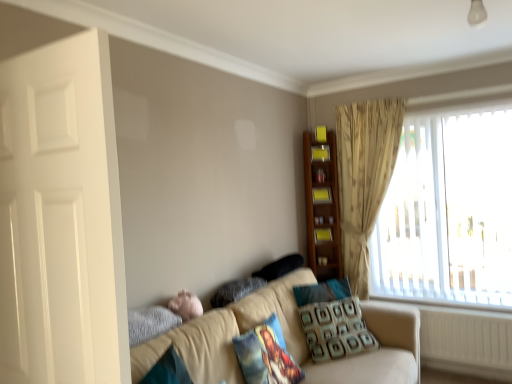
In order to face white glossy door at left, should I rotate leftwards or rightwards?

Turn left approximately 27.447 degrees to face it.

What do you see at coordinates (323, 235) in the screenshot? Image resolution: width=512 pixels, height=384 pixels. I see `wooden bookshelf at upper right, acting as the 3th shelf starting from the top` at bounding box center [323, 235].

The image size is (512, 384). What do you see at coordinates (280, 267) in the screenshot?
I see `black fabric pillow at center, the 4th pillow viewed from the front` at bounding box center [280, 267].

Measure the distance between black fabric pillow at center, placed as the 1th pillow when sorted from back to front, and camera.

A distance of 9.24 feet exists between black fabric pillow at center, placed as the 1th pillow when sorted from back to front, and camera.

Where is `translucent plastic window at right`? This screenshot has width=512, height=384. translucent plastic window at right is located at coordinates (448, 211).

Describe the element at coordinates (364, 177) in the screenshot. I see `beige textured curtain at upper right` at that location.

Describe the element at coordinates (466, 341) in the screenshot. I see `white plastic radiator at lower right` at that location.

Describe the element at coordinates (288, 340) in the screenshot. This screenshot has width=512, height=384. I see `beige fabric couch at lower center` at that location.

Where is `white glossy door at left`? This screenshot has height=384, width=512. white glossy door at left is located at coordinates (61, 218).

Is wooden bookshelf at upper right, acting as the 3th shelf starting from the top, to the left of white glossy door at left from the viewer's perspective?

No, wooden bookshelf at upper right, acting as the 3th shelf starting from the top, is not to the left of white glossy door at left.

Would you consider wooden bookshelf at upper right, acting as the 3th shelf starting from the top, to be distant from white glossy door at left?

Yes, wooden bookshelf at upper right, acting as the 3th shelf starting from the top, and white glossy door at left are quite far apart.

From the image's perspective, relative to white glossy door at left, is wooden bookshelf at upper right, acting as the 3th shelf starting from the top, above or below?

wooden bookshelf at upper right, acting as the 3th shelf starting from the top, is situated lower than white glossy door at left in the image.

Is white glossy door at left at the back of wooden bookshelf at upper right, acting as the 3th shelf starting from the top?

No, wooden bookshelf at upper right, acting as the 3th shelf starting from the top, is not facing away from white glossy door at left.

Are white glossy door at left and black fabric pillow at center, the 4th pillow viewed from the front, making contact?

white glossy door at left and black fabric pillow at center, the 4th pillow viewed from the front, are clearly separated.

Which of these two, white glossy door at left or black fabric pillow at center, placed as the 1th pillow when sorted from back to front, is bigger?

white glossy door at left is bigger.

Considering the sizes of objects white glossy door at left and black fabric pillow at center, placed as the 1th pillow when sorted from back to front, in the image provided, who is thinner, white glossy door at left or black fabric pillow at center, placed as the 1th pillow when sorted from back to front,?

With smaller width is white glossy door at left.

Which of these two, wooden shelf at upper right, which is the first shelf in top-to-bottom order, or pink plush at lower left, is wider?

Wider between the two is pink plush at lower left.

Based on the photo, which of these two, wooden shelf at upper right, which is the first shelf in top-to-bottom order, or pink plush at lower left, stands taller?

With more height is pink plush at lower left.

Is point (316, 157) positioned in front of point (195, 312)?

No, (316, 157) is further to viewer.

Is wooden shelf at upper right, the 3th shelf in the bottom-to-top sequence, behind pink plush at lower left?

Yes, it is.

Is white plastic radiator at lower right not close to black fabric pillow at center, placed as the 1th pillow when sorted from back to front?

Yes, white plastic radiator at lower right is far from black fabric pillow at center, placed as the 1th pillow when sorted from back to front.

Is white plastic radiator at lower right at the left side of black fabric pillow at center, the 4th pillow viewed from the front?

Incorrect, white plastic radiator at lower right is not on the left side of black fabric pillow at center, the 4th pillow viewed from the front.

Is black fabric pillow at center, placed as the 1th pillow when sorted from back to front, at the back of white plastic radiator at lower right?

white plastic radiator at lower right is not turned away from black fabric pillow at center, placed as the 1th pillow when sorted from back to front.

From a real-world perspective, between white plastic radiator at lower right and black fabric pillow at center, placed as the 1th pillow when sorted from back to front, who is vertically higher?

black fabric pillow at center, placed as the 1th pillow when sorted from back to front, from a real-world perspective.

From a real-world perspective, is wooden shelf at upper right, the 3th shelf in the bottom-to-top sequence, physically located above or below black fabric pillow at center, placed as the 1th pillow when sorted from back to front?

From a real-world perspective, wooden shelf at upper right, the 3th shelf in the bottom-to-top sequence, is physically above black fabric pillow at center, placed as the 1th pillow when sorted from back to front.

In the scene shown: Visually, is wooden shelf at upper right, which is the first shelf in top-to-bottom order, positioned to the left or to the right of black fabric pillow at center, placed as the 1th pillow when sorted from back to front?

wooden shelf at upper right, which is the first shelf in top-to-bottom order, is positioned on black fabric pillow at center, placed as the 1th pillow when sorted from back to front,'s right side.

Is point (318, 158) positioned behind point (278, 259)?

That is True.

Does white plastic radiator at lower right have a greater height compared to pink plush at lower left?

Yes, white plastic radiator at lower right is taller than pink plush at lower left.

In the scene shown: Considering the relative sizes of white plastic radiator at lower right and pink plush at lower left in the image provided, is white plastic radiator at lower right wider than pink plush at lower left?

No, white plastic radiator at lower right is not wider than pink plush at lower left.

Does point (431, 361) lie in front of point (183, 308)?

No, it is not.

In the image, is white plastic radiator at lower right on the left side or the right side of pink plush at lower left?

white plastic radiator at lower right is to the right of pink plush at lower left.

Can you tell me how much printed fabric pillow at center, the first pillow viewed from the front, and white plastic radiator at lower right differ in facing direction?

The angular difference between printed fabric pillow at center, the first pillow viewed from the front, and white plastic radiator at lower right is 89.8 degrees.

Is printed fabric pillow at center, the first pillow viewed from the front, turned away from white plastic radiator at lower right?

No, white plastic radiator at lower right is not at the back of printed fabric pillow at center, the first pillow viewed from the front.

Who is bigger, printed fabric pillow at center, which is counted as the 4th pillow, starting from the back, or white plastic radiator at lower right?

Bigger between the two is white plastic radiator at lower right.

Identify the location of radiator on the right of printed fabric pillow at center, the first pillow viewed from the front. The width and height of the screenshot is (512, 384). (466, 341).

Image resolution: width=512 pixels, height=384 pixels. In order to click on shelf below the white glossy door at left (from the image's perspective) in this screenshot , I will do `click(323, 235)`.

The width and height of the screenshot is (512, 384). Identify the location of screen door located above the black fabric pillow at center, placed as the 1th pillow when sorted from back to front (from the image's perspective). (61, 218).

Estimate the real-world distances between objects in this image. Which object is closer to wooden bookshelf at upper right, acting as the 1th shelf starting from the bottom, white plastic radiator at lower right or black fabric pillow at center, the 4th pillow viewed from the front?

black fabric pillow at center, the 4th pillow viewed from the front, lies closer to wooden bookshelf at upper right, acting as the 1th shelf starting from the bottom, than the other object.

Considering their positions, is wooden bookshelf at upper right, acting as the 1th shelf starting from the bottom, positioned closer to velvety gray pillow at lower center, the third pillow from the back, than white plastic radiator at lower right?

wooden bookshelf at upper right, acting as the 1th shelf starting from the bottom, lies closer to velvety gray pillow at lower center, the third pillow from the back, than the other object.

Which object lies nearer to the anchor point beige textured curtain at upper right, wooden bookshelf at upper right, acting as the 3th shelf starting from the top, or printed fabric pillow at center, which is counted as the 4th pillow, starting from the back?

Based on the image, wooden bookshelf at upper right, acting as the 3th shelf starting from the top, appears to be nearer to beige textured curtain at upper right.

Estimate the real-world distances between objects in this image. Which object is further from translucent plastic window at right, beige textured curtain at upper right or wooden shelf at upper right, which is the first shelf in top-to-bottom order?

wooden shelf at upper right, which is the first shelf in top-to-bottom order, is further to translucent plastic window at right.

Estimate the real-world distances between objects in this image. Which object is further from yellow matte bookshelf at upper right, which ranks as the 2th shelf in bottom-to-top order, wooden shelf at upper right, the 3th shelf in the bottom-to-top sequence, or white plastic radiator at lower right?

Based on the image, white plastic radiator at lower right appears to be further to yellow matte bookshelf at upper right, which ranks as the 2th shelf in bottom-to-top order.

Looking at this image, considering their positions, is wooden shelf at upper right, the 3th shelf in the bottom-to-top sequence, positioned closer to pink plush at lower left than yellow matte bookshelf at upper right, which ranks as the 2th shelf in bottom-to-top order?

Among the two, yellow matte bookshelf at upper right, which ranks as the 2th shelf in bottom-to-top order, is located nearer to pink plush at lower left.

Looking at the image, which one is located closer to white plastic radiator at lower right, velvety gray pillow at lower center, the third pillow from the back, or wooden bookshelf at upper right, acting as the 3th shelf starting from the top?

wooden bookshelf at upper right, acting as the 3th shelf starting from the top, is closer to white plastic radiator at lower right.

Considering their positions, is beige textured curtain at upper right positioned closer to beige fabric couch at lower center than white glossy door at left?

Based on the image, white glossy door at left appears to be nearer to beige fabric couch at lower center.

This screenshot has width=512, height=384. In order to click on pillow located between patterned fabric pillow at lower right, the second pillow when ordered from back to front, and wooden bookshelf at upper right, acting as the 3th shelf starting from the top, in the depth direction in this screenshot , I will do `click(280, 267)`.

Find the location of a particular element. curtain between printed fabric pillow at center, which is counted as the 4th pillow, starting from the back, and wooden bookshelf at upper right, acting as the 3th shelf starting from the top, along the z-axis is located at coordinates (364, 177).

Where is `shelf between printed fabric pillow at center, the first pillow viewed from the front, and wooden shelf at upper right, which is the first shelf in top-to-bottom order, from front to back`? shelf between printed fabric pillow at center, the first pillow viewed from the front, and wooden shelf at upper right, which is the first shelf in top-to-bottom order, from front to back is located at coordinates (322, 195).

Where is `pillow located between white glossy door at left and velvety gray pillow at lower center, the third pillow from the back, in the depth direction`? pillow located between white glossy door at left and velvety gray pillow at lower center, the third pillow from the back, in the depth direction is located at coordinates (266, 355).